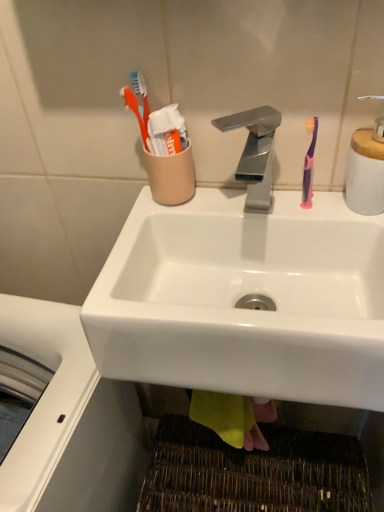
Question: Would you say pink plastic toothbrush at right is outside polished metallic faucet at center?

Choices:
 (A) yes
 (B) no

Answer: (A)

Question: Considering the relative positions of pink plastic toothbrush at right and polished metallic faucet at center in the image provided, is pink plastic toothbrush at right to the left of polished metallic faucet at center from the viewer's perspective?

Choices:
 (A) yes
 (B) no

Answer: (B)

Question: Is pink plastic toothbrush at right next to polished metallic faucet at center?

Choices:
 (A) yes
 (B) no

Answer: (A)

Question: Can you confirm if pink plastic toothbrush at right is shorter than polished metallic faucet at center?

Choices:
 (A) no
 (B) yes

Answer: (A)

Question: Considering the relative sizes of pink plastic toothbrush at right and polished metallic faucet at center in the image provided, is pink plastic toothbrush at right thinner than polished metallic faucet at center?

Choices:
 (A) yes
 (B) no

Answer: (A)

Question: Could you tell me if pink plastic toothbrush at right is turned towards polished metallic faucet at center?

Choices:
 (A) yes
 (B) no

Answer: (B)

Question: Does polished metallic faucet at center lie in front of pink plastic toothbrush at right?

Choices:
 (A) no
 (B) yes

Answer: (B)

Question: Is polished metallic faucet at center turned away from pink plastic toothbrush at right?

Choices:
 (A) yes
 (B) no

Answer: (B)

Question: From the image's perspective, is polished metallic faucet at center on top of pink plastic toothbrush at right?

Choices:
 (A) yes
 (B) no

Answer: (B)

Question: Is the position of polished metallic faucet at center more distant than that of pink plastic toothbrush at right?

Choices:
 (A) yes
 (B) no

Answer: (B)

Question: Can you confirm if polished metallic faucet at center is positioned to the right of pink plastic toothbrush at right?

Choices:
 (A) yes
 (B) no

Answer: (B)

Question: Considering the relative sizes of polished metallic faucet at center and pink plastic toothbrush at right in the image provided, is polished metallic faucet at center bigger than pink plastic toothbrush at right?

Choices:
 (A) yes
 (B) no

Answer: (A)

Question: From the image's perspective, does white ceramic soap dispenser at upper right appear lower than polished metallic faucet at center?

Choices:
 (A) no
 (B) yes

Answer: (A)